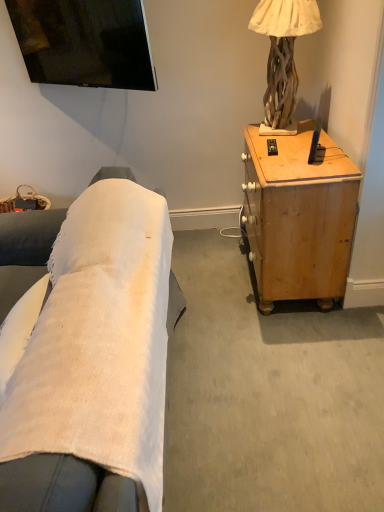
Where is `vacant space positioned to the left of light brown wood desk at right`? vacant space positioned to the left of light brown wood desk at right is located at coordinates (211, 284).